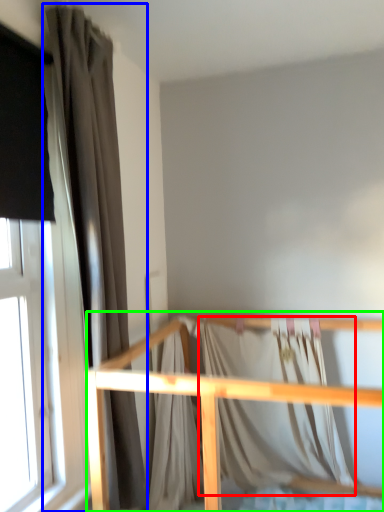
Question: Based on their relative distances, which object is nearer to blanket (highlighted by a red box)? Choose from curtain (highlighted by a blue box) and rail (highlighted by a green box).

Choices:
 (A) curtain
 (B) rail

Answer: (B)